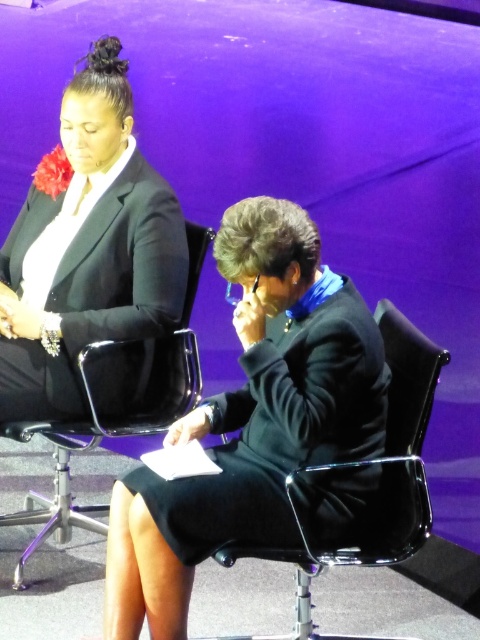
You are a stagehand preparing to adjust the lighting for a performance. You need to position a spotlight so it illuminates the black matte dress at lower center without shining directly on the black plastic swivel chair at center. Based on their positions, can you do this?

The black matte dress at lower center is in front of the black plastic swivel chair at center, so positioning the spotlight to shine on the dress while avoiding the chair is possible by angling it to focus on the dress in front.

You are standing in front of the stage and want to reach the black matte dress at lower center. The stage is 7 feet high. Do you think you can safely step onto the stage to get it?

The black matte dress at lower center is 6.88 feet away from the viewer, but the stage is 7 feet high. Since the distance to the dress is slightly less than the stage height, stepping onto the stage might be possible but could be risky due to the height difference. It is safer to use a ladder or ask for assistance.

You are organizing a small event and need to determine if the black matte dress at lower center can fit on the black plastic chair at center. Based on their sizes, will the dress fit on the chair?

The black matte dress at lower center is narrower than the black plastic chair at center, so it should fit on the chair.